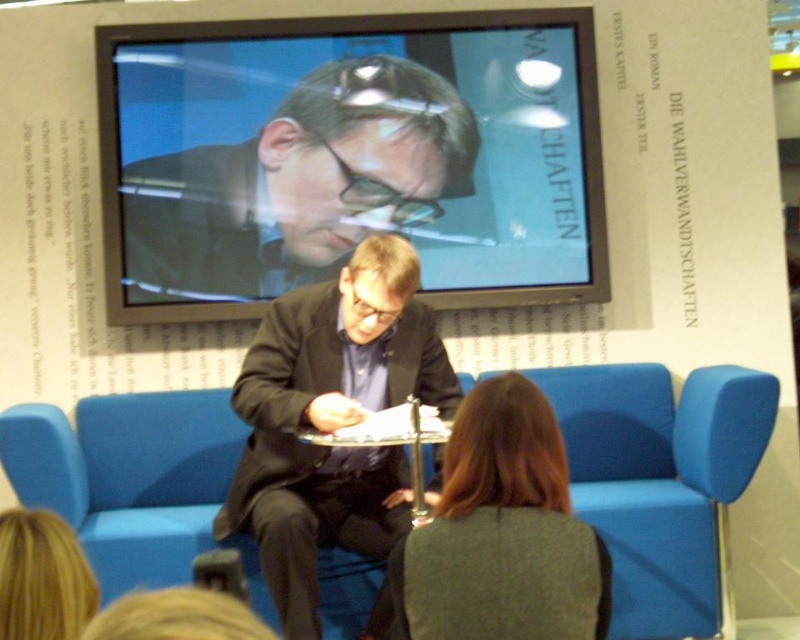
Question: Estimate the real-world distances between objects in this image. Which object is closer to the blonde hair at lower left?

Choices:
 (A) dark brown hair at center
 (B) matte black screen at upper center
 (C) dark brown suit at center

Answer: (A)

Question: Based on their relative distances, which object is nearer to the dark brown suit at center?

Choices:
 (A) matte black screen at upper center
 (B) blonde hair at lower left

Answer: (A)

Question: Based on their relative distances, which object is nearer to the dark brown suit at center?

Choices:
 (A) blonde hair at lower left
 (B) dark brown hair at center

Answer: (B)

Question: Does matte black screen at upper center have a lesser width compared to dark brown suit at center?

Choices:
 (A) yes
 (B) no

Answer: (B)

Question: Does dark brown hair at center appear on the right side of blonde hair at lower left?

Choices:
 (A) no
 (B) yes

Answer: (B)

Question: Can you confirm if dark brown hair at center is positioned below blonde hair at lower left?

Choices:
 (A) yes
 (B) no

Answer: (A)